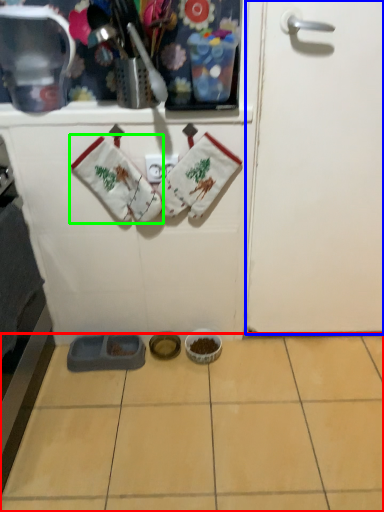
Question: Which object is positioned farthest from ceramic tile (highlighted by a red box)? Select from door (highlighted by a blue box) and baby clothe (highlighted by a green box).

Choices:
 (A) door
 (B) baby clothe

Answer: (B)